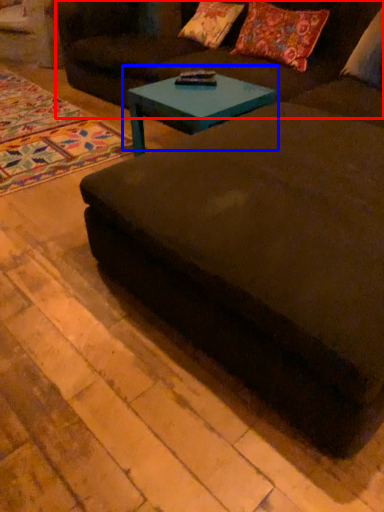
Question: Which object is closer to the camera taking this photo, couch (highlighted by a red box) or coffee table (highlighted by a blue box)?

Choices:
 (A) couch
 (B) coffee table

Answer: (A)